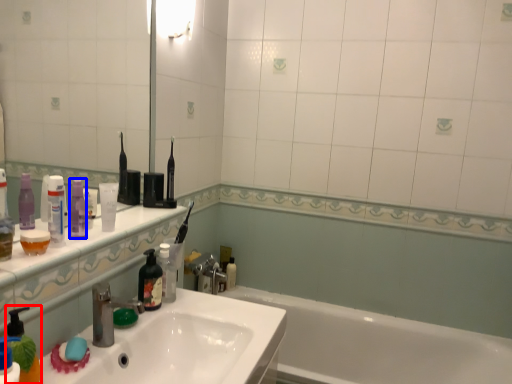
Question: Which of the following is the farthest to the observer, soap dispenser (highlighted by a red box) or toiletry (highlighted by a blue box)?

Choices:
 (A) soap dispenser
 (B) toiletry

Answer: (B)